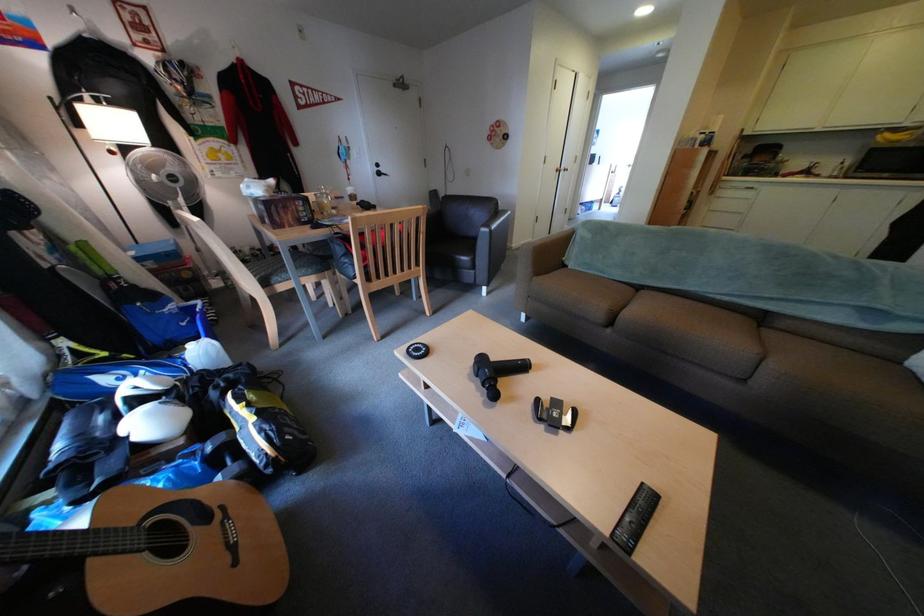
At what (x,y) coordinates should I click in order to perform the action: click on black door handle. Please return your answer as a coordinate pair (x, y). Looking at the image, I should click on (379, 169).